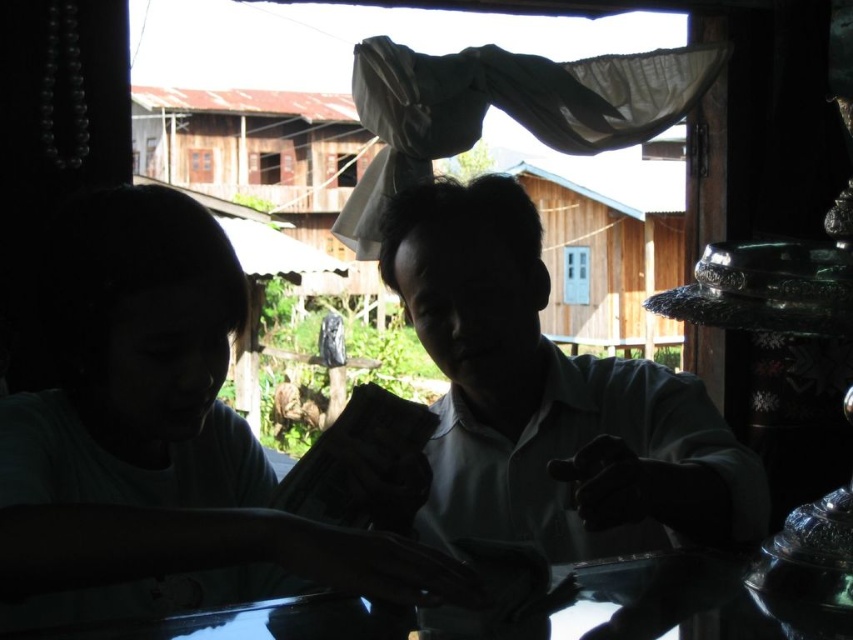
Question: Estimate the real-world distances between objects in this image. Which object is closer to the white glossy shirt at center?

Choices:
 (A) light green t-shirt at left
 (B) glossy glass table at lower center

Answer: (B)

Question: Can you confirm if white glossy shirt at center is smaller than glossy glass table at lower center?

Choices:
 (A) no
 (B) yes

Answer: (A)

Question: Estimate the real-world distances between objects in this image. Which object is closer to the white glossy shirt at center?

Choices:
 (A) light green t-shirt at left
 (B) glossy glass table at lower center

Answer: (B)

Question: Which point is farther to the camera?

Choices:
 (A) white glossy shirt at center
 (B) glossy glass table at lower center
 (C) light green t-shirt at left

Answer: (A)

Question: Where is light green t-shirt at left located in relation to white glossy shirt at center in the image?

Choices:
 (A) above
 (B) below

Answer: (B)

Question: Is light green t-shirt at left closer to the viewer compared to white glossy shirt at center?

Choices:
 (A) no
 (B) yes

Answer: (B)